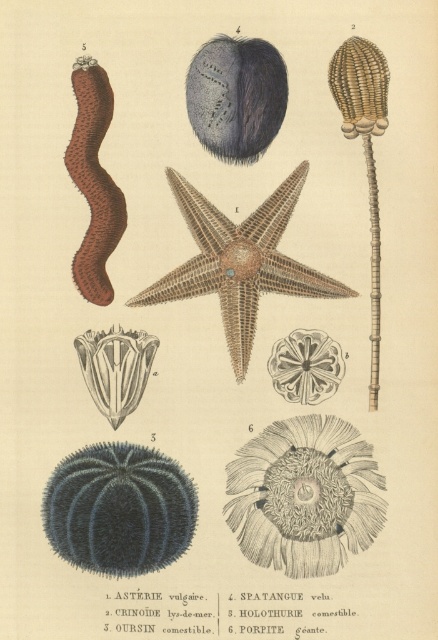
Question: Is white paper at center closer to camera compared to translucent white coral at center?

Choices:
 (A) no
 (B) yes

Answer: (B)

Question: Can you confirm if blue spiny sea urchin at upper left is positioned below white paper at center?

Choices:
 (A) no
 (B) yes

Answer: (A)

Question: Does white paper at center appear on the left side of translucent white coral at center?

Choices:
 (A) no
 (B) yes

Answer: (A)

Question: Which point is closer to the camera?

Choices:
 (A) (201, 225)
 (B) (193, 280)
 (C) (233, 112)

Answer: (C)

Question: Which object is positioned closest to the translucent white coral at center?

Choices:
 (A) blue spiny sea urchin at upper left
 (B) fuzzy dark blue sea urchin at center
 (C) brown textured starfish at center

Answer: (C)

Question: Which of the following is the farthest from the observer?

Choices:
 (A) blue spiny sea urchin at upper left
 (B) blue spiny sea urchin at lower left

Answer: (A)